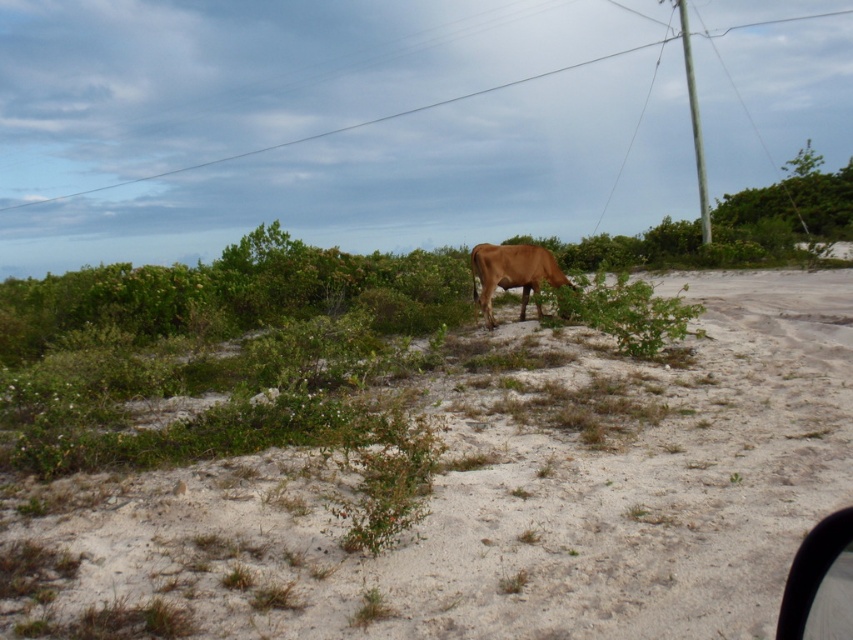
Is point (819, 534) positioned before point (483, 308)?

Yes, it is.

Does point (807, 545) come farther from viewer compared to point (532, 269)?

That is False.

Between point (802, 564) and point (480, 284), which one is positioned in front?

Point (802, 564)

This screenshot has width=853, height=640. I want to click on transparent glass car window at lower right, so click(811, 572).

Is point (383, 556) less distant than point (502, 269)?

Yes, it is in front of point (502, 269).

Can you confirm if brown sandy soil at center is thinner than brown matte cow at center?

No, brown sandy soil at center is not thinner than brown matte cow at center.

Is point (570, 348) positioned behind point (514, 285)?

No, (570, 348) is in front of (514, 285).

Identify the location of brown sandy soil at center. (503, 493).

Is brown sandy soil at center wider than transparent glass car window at lower right?

Indeed, brown sandy soil at center has a greater width compared to transparent glass car window at lower right.

Who is positioned more to the right, brown sandy soil at center or transparent glass car window at lower right?

brown sandy soil at center

The height and width of the screenshot is (640, 853). I want to click on brown sandy soil at center, so click(503, 493).